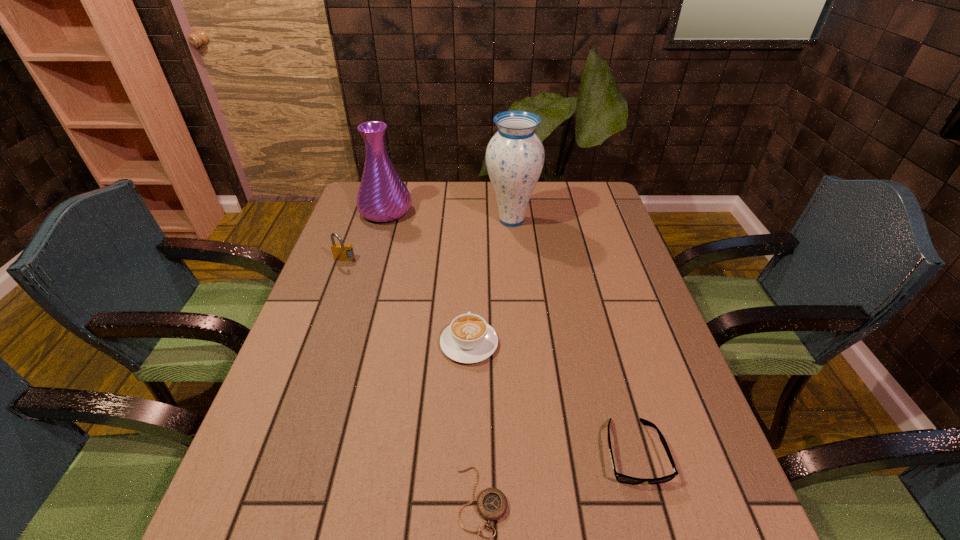
Find the location of `free space located 0.300m on the right of the left vase`. free space located 0.300m on the right of the left vase is located at coordinates pos(499,212).

The width and height of the screenshot is (960, 540). I want to click on vacant area situated on the side with the combination dials of the padlock, so click(338, 279).

Find the location of `vacant space located on the side of the third nearest object with the handle`. vacant space located on the side of the third nearest object with the handle is located at coordinates (471, 234).

At what (x,y) coordinates should I click in order to perform the action: click on vacant region located 0.260m on the side of the third nearest object with the handle. Please return your answer as a coordinate pair (x, y). The height and width of the screenshot is (540, 960). Looking at the image, I should click on (471, 259).

Where is `free space located 0.290m on the side of the third nearest object with the handle`? This screenshot has width=960, height=540. free space located 0.290m on the side of the third nearest object with the handle is located at coordinates (471, 253).

What are the coordinates of `vacant region located 0.070m on the front-facing side of the rightmost object` in the screenshot? It's located at (656, 530).

Find the location of a particular element. free space located on the left of the pocket watch is located at coordinates (385, 501).

Locate an element on the screen. The image size is (960, 540). object that is at the near edge is located at coordinates (492, 504).

Locate an element on the screen. This screenshot has width=960, height=540. vase positioned at the left edge is located at coordinates click(382, 196).

Find the location of a particular element. This screenshot has height=540, width=960. padlock that is at the left edge is located at coordinates (341, 252).